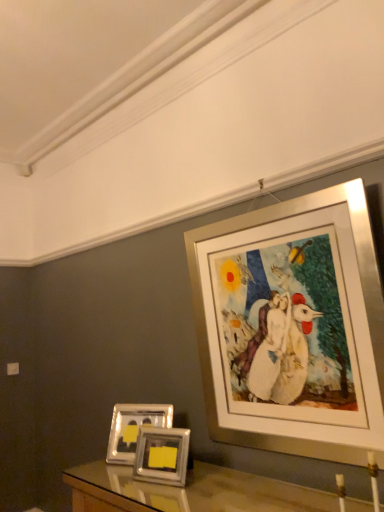
Question: Is silver metallic picture frame at upper right, marked as the 3th picture frame in a left-to-right arrangement, looking in the opposite direction of silver metallic photo frames at lower center, placed as the second picture frame when sorted from left to right?

Choices:
 (A) yes
 (B) no

Answer: (B)

Question: From a real-world perspective, does silver metallic picture frame at upper right, marked as the 3th picture frame in a left-to-right arrangement, sit lower than silver metallic photo frames at lower center, the 2th picture frame viewed from the right?

Choices:
 (A) no
 (B) yes

Answer: (A)

Question: From a real-world perspective, is silver metallic picture frame at upper right, marked as the 3th picture frame in a left-to-right arrangement, on silver metallic photo frames at lower center, placed as the second picture frame when sorted from left to right?

Choices:
 (A) no
 (B) yes

Answer: (B)

Question: Can you confirm if silver metallic picture frame at upper right, the 1th picture frame in the right-to-left sequence, is bigger than silver metallic photo frames at lower center, the 2th picture frame viewed from the right?

Choices:
 (A) no
 (B) yes

Answer: (B)

Question: Is silver metallic picture frame at upper right, marked as the 3th picture frame in a left-to-right arrangement, far from silver metallic photo frames at lower center, placed as the second picture frame when sorted from left to right?

Choices:
 (A) yes
 (B) no

Answer: (B)

Question: Looking at the image, does metallic silver picture frame at lower left, the third picture frame positioned from the right, seem bigger or smaller compared to silver metallic picture frame at upper right, marked as the 3th picture frame in a left-to-right arrangement?

Choices:
 (A) big
 (B) small

Answer: (B)

Question: In terms of width, does metallic silver picture frame at lower left, the 1th picture frame positioned from the left, look wider or thinner when compared to silver metallic picture frame at upper right, marked as the 3th picture frame in a left-to-right arrangement?

Choices:
 (A) thin
 (B) wide

Answer: (B)

Question: From the image's perspective, is metallic silver picture frame at lower left, the 1th picture frame positioned from the left, located above or below silver metallic picture frame at upper right, marked as the 3th picture frame in a left-to-right arrangement?

Choices:
 (A) above
 (B) below

Answer: (B)

Question: Considering the positions of metallic silver picture frame at lower left, the third picture frame positioned from the right, and silver metallic picture frame at upper right, the 1th picture frame in the right-to-left sequence, in the image, is metallic silver picture frame at lower left, the third picture frame positioned from the right, taller or shorter than silver metallic picture frame at upper right, the 1th picture frame in the right-to-left sequence,?

Choices:
 (A) tall
 (B) short

Answer: (B)

Question: Based on their sizes in the image, would you say silver metallic photo frames at lower center, placed as the second picture frame when sorted from left to right, is bigger or smaller than metallic silver picture frame at lower left, the third picture frame positioned from the right?

Choices:
 (A) small
 (B) big

Answer: (A)

Question: Looking at their shapes, would you say silver metallic photo frames at lower center, the 2th picture frame viewed from the right, is wider or thinner than metallic silver picture frame at lower left, the 1th picture frame positioned from the left?

Choices:
 (A) thin
 (B) wide

Answer: (A)

Question: From the image's perspective, is silver metallic photo frames at lower center, placed as the second picture frame when sorted from left to right, positioned above or below metallic silver picture frame at lower left, the 1th picture frame positioned from the left?

Choices:
 (A) above
 (B) below

Answer: (A)

Question: From a real-world perspective, is silver metallic photo frames at lower center, placed as the second picture frame when sorted from left to right, physically located above or below metallic silver picture frame at lower left, the 1th picture frame positioned from the left?

Choices:
 (A) below
 (B) above

Answer: (A)

Question: Considering the positions of silver metallic photo frames at lower center, placed as the second picture frame when sorted from left to right, and silver metallic picture frame at upper right, the 1th picture frame in the right-to-left sequence, in the image, is silver metallic photo frames at lower center, placed as the second picture frame when sorted from left to right, taller or shorter than silver metallic picture frame at upper right, the 1th picture frame in the right-to-left sequence,?

Choices:
 (A) short
 (B) tall

Answer: (A)

Question: From a real-world perspective, is silver metallic photo frames at lower center, the 2th picture frame viewed from the right, positioned above or below silver metallic picture frame at upper right, the 1th picture frame in the right-to-left sequence?

Choices:
 (A) below
 (B) above

Answer: (A)